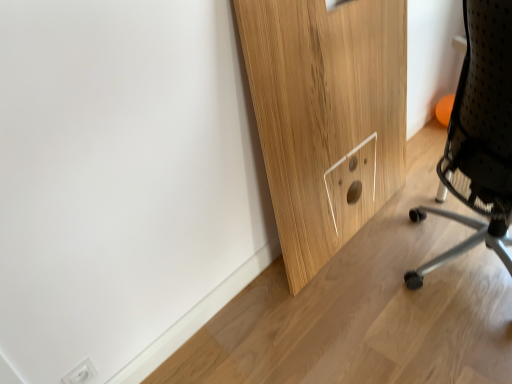
What do you see at coordinates (479, 137) in the screenshot? This screenshot has width=512, height=384. I see `black mesh chair at right` at bounding box center [479, 137].

Identify the location of black mesh chair at right. The image size is (512, 384). (479, 137).

Find the location of a particular element. The width and height of the screenshot is (512, 384). white plastic electric outlet at lower left is located at coordinates (81, 373).

The height and width of the screenshot is (384, 512). Describe the element at coordinates (81, 373) in the screenshot. I see `white plastic electric outlet at lower left` at that location.

The height and width of the screenshot is (384, 512). In order to click on black mesh chair at right in this screenshot , I will do `click(479, 137)`.

In the image, is white plastic electric outlet at lower left on the left side or the right side of black mesh chair at right?

In the image, white plastic electric outlet at lower left appears on the left side of black mesh chair at right.

Which is behind, white plastic electric outlet at lower left or black mesh chair at right?

white plastic electric outlet at lower left is behind.

Is point (94, 373) closer to viewer compared to point (495, 141)?

No, (94, 373) is behind (495, 141).

From the image's perspective, between white plastic electric outlet at lower left and black mesh chair at right, who is located below?

white plastic electric outlet at lower left.

From a real-world perspective, who is located higher, white plastic electric outlet at lower left or black mesh chair at right?

In real-world perspective, black mesh chair at right is above.

Considering the sizes of white plastic electric outlet at lower left and black mesh chair at right in the image, is white plastic electric outlet at lower left wider or thinner than black mesh chair at right?

white plastic electric outlet at lower left is thinner than black mesh chair at right.

Which of these two, white plastic electric outlet at lower left or black mesh chair at right, stands taller?

Standing taller between the two is black mesh chair at right.

Is white plastic electric outlet at lower left smaller than black mesh chair at right?

Yes, white plastic electric outlet at lower left is smaller than black mesh chair at right.

Is white plastic electric outlet at lower left not inside black mesh chair at right?

Yes, white plastic electric outlet at lower left is not within black mesh chair at right.

Is white plastic electric outlet at lower left directly adjacent to black mesh chair at right?

No.

Could you tell me if white plastic electric outlet at lower left is facing black mesh chair at right?

No, white plastic electric outlet at lower left is not aimed at black mesh chair at right.

How many degrees apart are the facing directions of white plastic electric outlet at lower left and black mesh chair at right?

The facing directions of white plastic electric outlet at lower left and black mesh chair at right are 124 degrees apart.

Consider the image. How much distance is there between white plastic electric outlet at lower left and black mesh chair at right?

The distance of white plastic electric outlet at lower left from black mesh chair at right is 4.40 feet.

The width and height of the screenshot is (512, 384). Identify the location of chair to the right of white plastic electric outlet at lower left. (479, 137).

Is black mesh chair at right at the left side of white plastic electric outlet at lower left?

Incorrect, black mesh chair at right is not on the left side of white plastic electric outlet at lower left.

Which object is further away from the camera taking this photo, black mesh chair at right or white plastic electric outlet at lower left?

white plastic electric outlet at lower left is further away from the camera.

Considering the positions of point (477, 9) and point (85, 369), is point (477, 9) closer or farther from the camera than point (85, 369)?

Point (477, 9) is closer to the camera than point (85, 369).

From the image's perspective, which object appears higher, black mesh chair at right or white plastic electric outlet at lower left?

black mesh chair at right is shown above in the image.

From a real-world perspective, is black mesh chair at right physically above white plastic electric outlet at lower left?

Yes, from a real-world perspective, black mesh chair at right is on top of white plastic electric outlet at lower left.

Which of these two, black mesh chair at right or white plastic electric outlet at lower left, is thinner?

With smaller width is white plastic electric outlet at lower left.

Between black mesh chair at right and white plastic electric outlet at lower left, which one has less height?

With less height is white plastic electric outlet at lower left.

Based on the photo, in terms of size, does black mesh chair at right appear bigger or smaller than white plastic electric outlet at lower left?

Considering their sizes, black mesh chair at right takes up more space than white plastic electric outlet at lower left.

Is black mesh chair at right outside of white plastic electric outlet at lower left?

Yes, black mesh chair at right is outside of white plastic electric outlet at lower left.

Does black mesh chair at right touch white plastic electric outlet at lower left?

No, black mesh chair at right is not beside white plastic electric outlet at lower left.

Is black mesh chair at right oriented away from white plastic electric outlet at lower left?

No, black mesh chair at right is not facing the opposite direction of white plastic electric outlet at lower left.

Can you tell me how much black mesh chair at right and white plastic electric outlet at lower left differ in facing direction?

The angular difference between black mesh chair at right and white plastic electric outlet at lower left is 124 degrees.

This screenshot has width=512, height=384. Identify the location of electric outlet that appears below the black mesh chair at right (from the image's perspective). (81, 373).

Locate an element on the screen. electric outlet on the left of black mesh chair at right is located at coordinates (81, 373).

Locate an element on the screen. chair above the white plastic electric outlet at lower left (from a real-world perspective) is located at coordinates (479, 137).